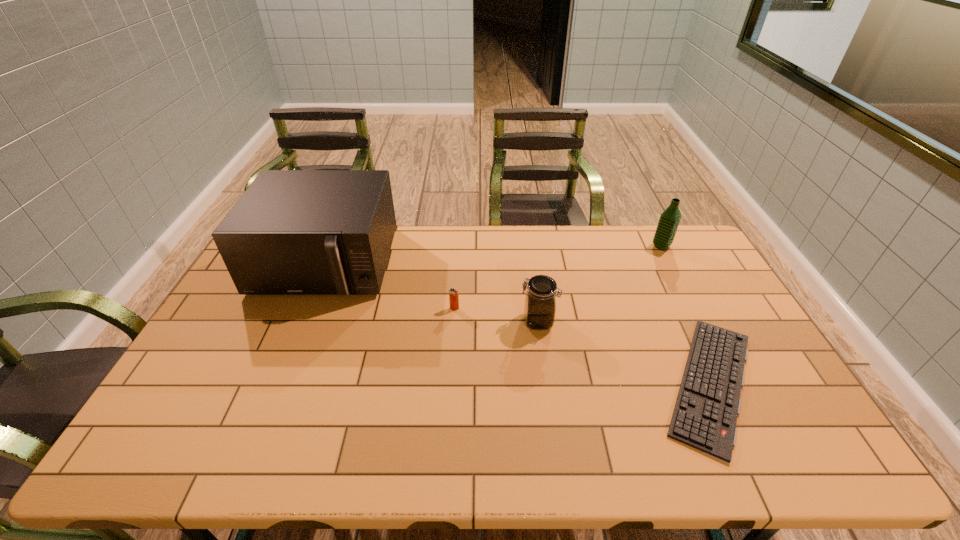
This screenshot has width=960, height=540. In order to click on the tallest object in this screenshot , I will do `click(292, 232)`.

The image size is (960, 540). What are the coordinates of `the leftmost object` in the screenshot? It's located at (292, 232).

In order to click on water bottle in this screenshot , I will do `click(669, 220)`.

Locate an element on the screen. The width and height of the screenshot is (960, 540). the third shortest object is located at coordinates (540, 303).

You are a GUI agent. You are given a task and a screenshot of the screen. Output one action in this format:
    pyautogui.click(x=<x>, y=<y>)
    Task: Click on the jar
    This screenshot has height=540, width=960.
    Given the screenshot: What is the action you would take?
    pyautogui.click(x=540, y=303)

Where is `the second object from left to right`? the second object from left to right is located at coordinates (453, 293).

Where is `igniter`? igniter is located at coordinates (453, 293).

You are a GUI agent. You are given a task and a screenshot of the screen. Output one action in this format:
    pyautogui.click(x=<x>, y=<y>)
    Task: Click on the shortest object
    This screenshot has width=960, height=540.
    Given the screenshot: What is the action you would take?
    pyautogui.click(x=705, y=414)

This screenshot has width=960, height=540. I want to click on free location located on the front-facing side of the tallest object, so click(x=301, y=320).

In order to click on vacant space located on the left of the second tallest object in this screenshot , I will do `click(549, 246)`.